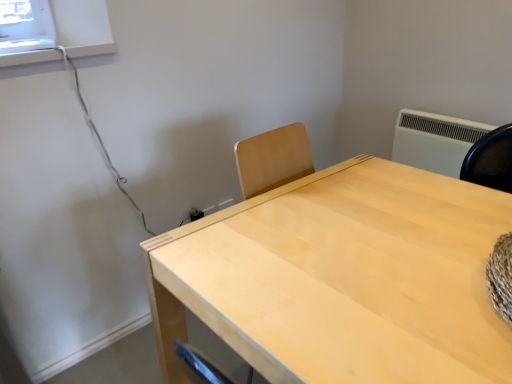
Question: Does point (466, 140) appear closer or farther from the camera than point (348, 183)?

Choices:
 (A) closer
 (B) farther

Answer: (B)

Question: Considering the positions of white plastic air conditioning unit at upper right and light wood table at center in the image, is white plastic air conditioning unit at upper right taller or shorter than light wood table at center?

Choices:
 (A) short
 (B) tall

Answer: (A)

Question: In the image, is white plastic air conditioning unit at upper right on the left side or the right side of light wood table at center?

Choices:
 (A) right
 (B) left

Answer: (A)

Question: From a real-world perspective, is light wood table at center positioned above or below white plastic air conditioning unit at upper right?

Choices:
 (A) above
 (B) below

Answer: (B)

Question: Is point (223, 261) positioned closer to the camera than point (399, 153)?

Choices:
 (A) closer
 (B) farther

Answer: (A)

Question: Considering the positions of light wood table at center and white plastic air conditioning unit at upper right in the image, is light wood table at center taller or shorter than white plastic air conditioning unit at upper right?

Choices:
 (A) short
 (B) tall

Answer: (B)

Question: Considering the positions of light wood table at center and white plastic air conditioning unit at upper right in the image, is light wood table at center wider or thinner than white plastic air conditioning unit at upper right?

Choices:
 (A) thin
 (B) wide

Answer: (B)